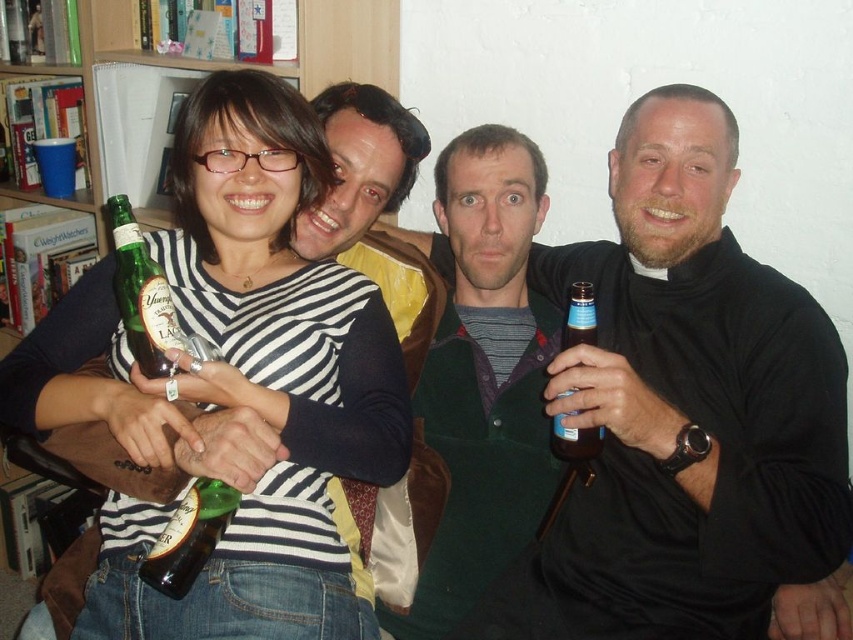
You are a photographer trying to capture a candid shot of the smooth brown leather jacket at center and the green glass bottle at left. Since you want to ensure both subjects are in focus, you need to know their relative positions. Which object is positioned to the right of the other?

The smooth brown leather jacket at center is to the right of the green glass bottle at left.

You are standing in the room and want to touch the smooth brown leather jacket at center. Which direction should you move your hand to reach the point at coordinates point (683, 410)?

The point at (683, 410) is located on the smooth brown leather jacket at center, so you should move your hand towards the center of the jacket to reach it.

Based on the scene description, which object is taller between the smooth brown leather jacket at center and the matte black shirt at center?

The smooth brown leather jacket at center is taller than the matte black shirt at center according to the description.